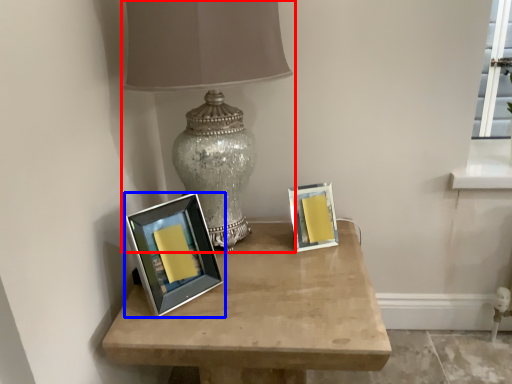
Question: Which object appears closest to the camera in this image, lamp (highlighted by a red box) or picture frame (highlighted by a blue box)?

Choices:
 (A) lamp
 (B) picture frame

Answer: (A)